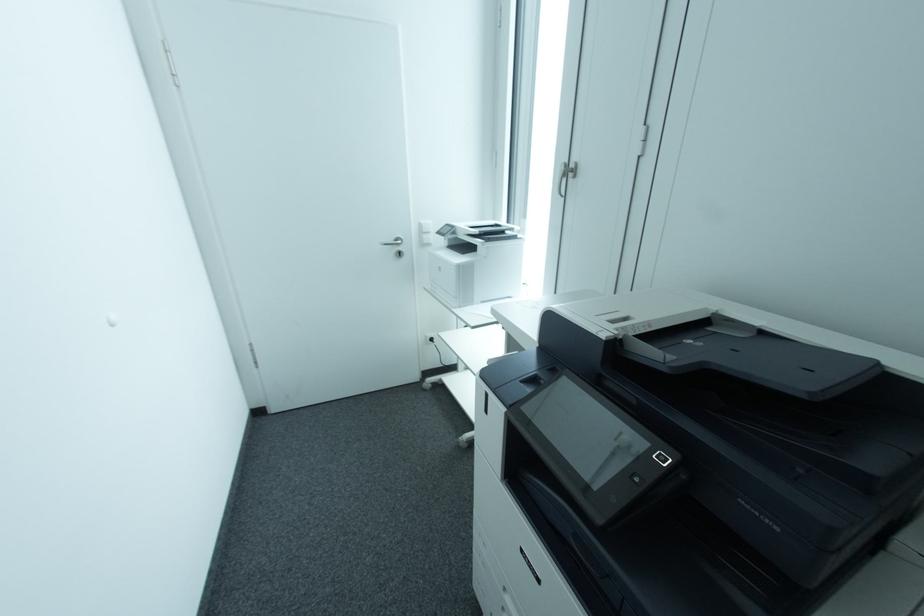
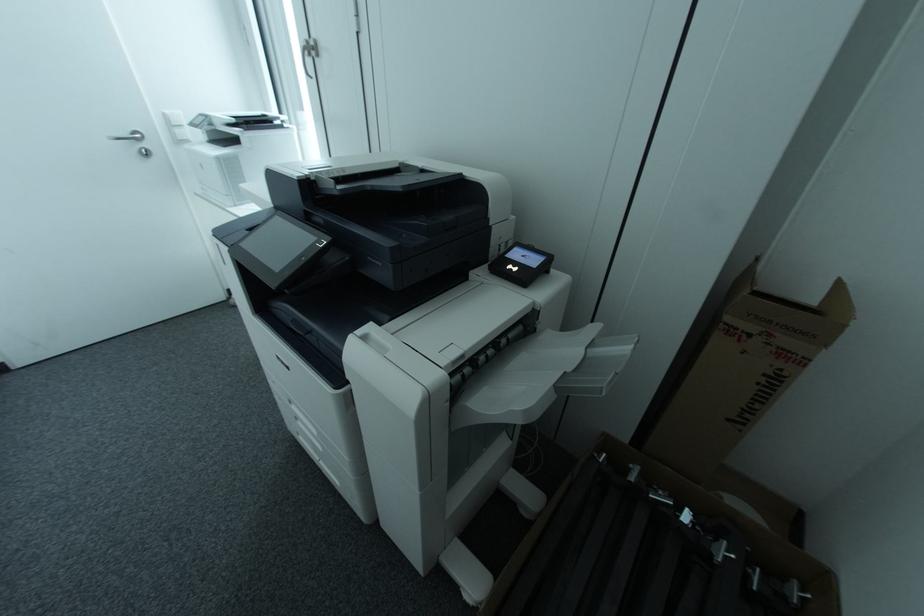
Question: The first image is from the beginning of the video and the second image is from the end. How did the camera likely rotate when shooting the video?

Choices:
 (A) Left
 (B) Right
 (C) Up
 (D) Down

Answer: (B)